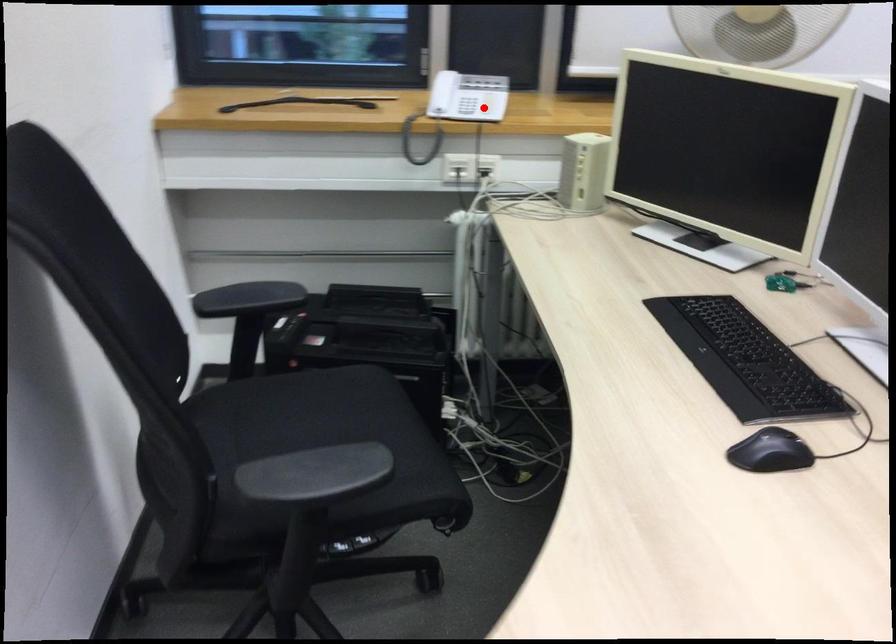
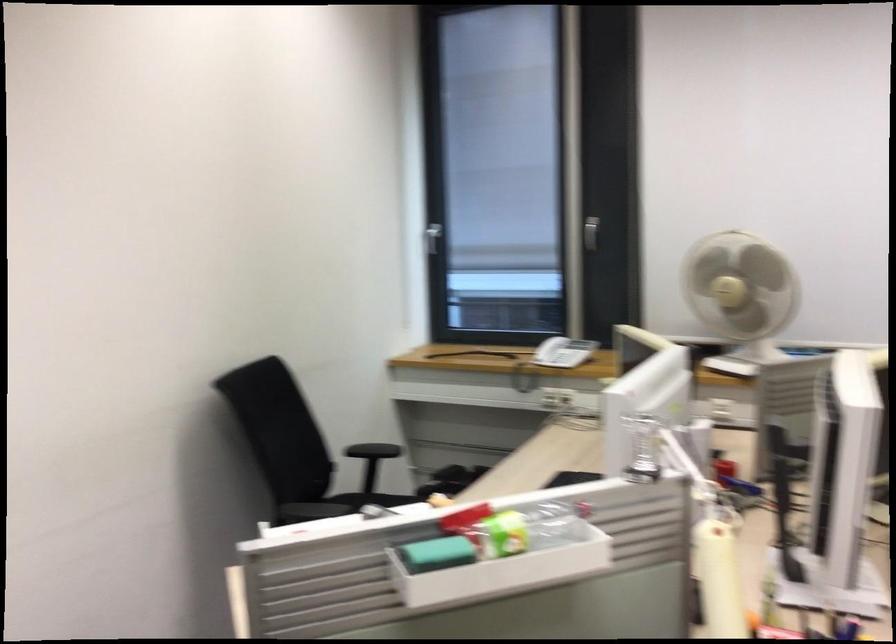
Question: I am providing you with two images of the same scene from different viewpoints. A red point is marked on the first image. Is the red point's position out of view in image 2?

Choices:
 (A) Yes
 (B) No

Answer: (B)